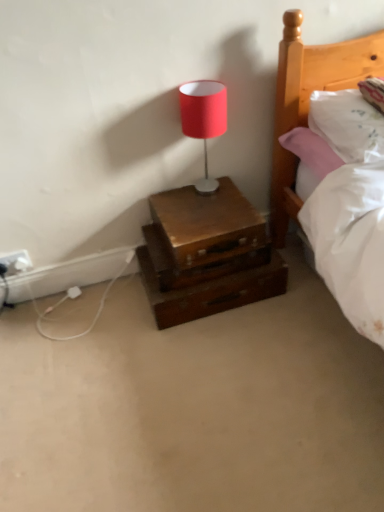
The width and height of the screenshot is (384, 512). I want to click on vacant area that lies in front of matte red lampshade at upper center, so click(209, 215).